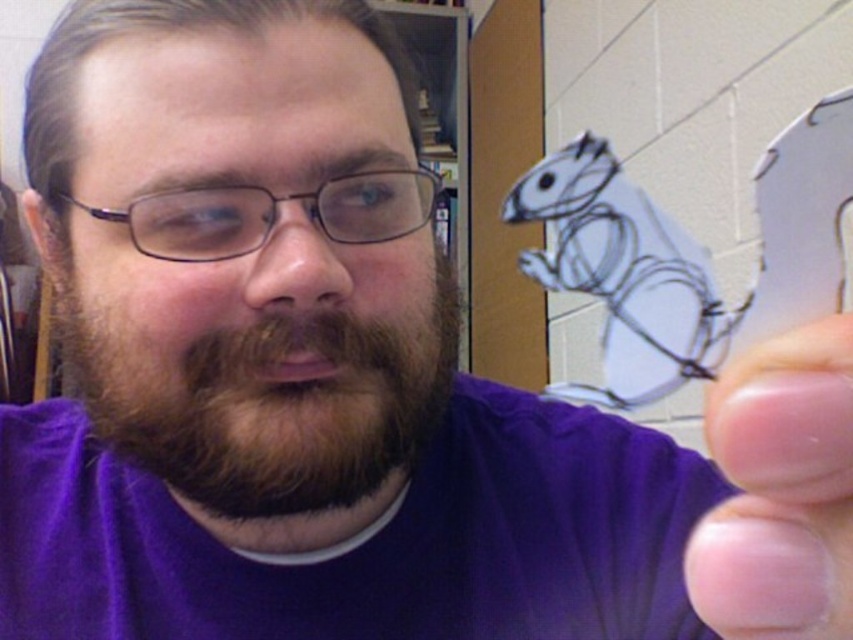
Who is positioned more to the left, brownwoollybeard at center or white paper squirrel at upper center?

From the viewer's perspective, brownwoollybeard at center appears more on the left side.

The height and width of the screenshot is (640, 853). What are the coordinates of `brownwoollybeard at center` in the screenshot? It's located at (276, 403).

Identify the location of brownwoollybeard at center. The image size is (853, 640). (276, 403).

Is point (787, 515) positioned in front of point (570, 260)?

Yes, it is.

Measure the distance from transparent plastic hand at right to white paper squirrel at upper center.

74.54 centimeters

Measure the distance between point (776, 508) and camera.

Point (776, 508) is 14.87 centimeters away from camera.

At what (x,y) coordinates should I click in order to perform the action: click on transparent plastic hand at right. Please return your answer as a coordinate pair (x, y). This screenshot has height=640, width=853. Looking at the image, I should click on (780, 492).

Can you confirm if brownwoollybeard at center is positioned below transparent plastic hand at right?

No.

Locate an element on the screen. The height and width of the screenshot is (640, 853). brownwoollybeard at center is located at coordinates (276, 403).